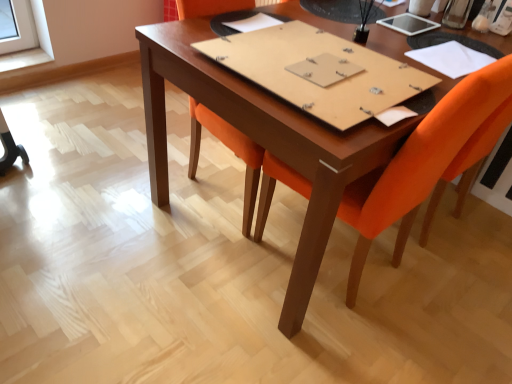
What do you see at coordinates (253, 23) in the screenshot?
I see `white paper at center, which is the 1th notebook from left to right` at bounding box center [253, 23].

The width and height of the screenshot is (512, 384). I want to click on white paper at center, the third notebook viewed from the right, so click(253, 23).

Does point (414, 149) lie in front of point (433, 67)?

Yes, it is in front of point (433, 67).

Based on the photo, how many degrees apart are the facing directions of orange fabric chair at center and white paper at upper right, the third notebook when ordered from left to right?

orange fabric chair at center and white paper at upper right, the third notebook when ordered from left to right, are facing 8.11 degrees away from each other.

Is orange fabric chair at center inside or outside of white paper at upper right, the third notebook when ordered from left to right?

orange fabric chair at center lies outside white paper at upper right, the third notebook when ordered from left to right.

Which is more to the left, orange fabric chair at center or white paper at upper right, the first notebook in the right-to-left sequence?

Positioned to the left is orange fabric chair at center.

Does white paper at upper right, the third notebook when ordered from left to right, turn towards brown cardboard notebook at center, acting as the second notebook starting from the left?

No.

Is white paper at upper right, the third notebook when ordered from left to right, next to brown cardboard notebook at center, acting as the second notebook starting from the left?

No, white paper at upper right, the third notebook when ordered from left to right, is not touching brown cardboard notebook at center, acting as the second notebook starting from the left.

Considering the sizes of objects white paper at upper right, the third notebook when ordered from left to right, and brown cardboard notebook at center, acting as the second notebook starting from the left, in the image provided, who is shorter, white paper at upper right, the third notebook when ordered from left to right, or brown cardboard notebook at center, acting as the second notebook starting from the left,?

white paper at upper right, the third notebook when ordered from left to right, is shorter.

How different are the orientations of white paper at upper right, the third notebook when ordered from left to right, and brown cardboard notebook at center, which is the 2th notebook in right-to-left order, in degrees?

The angular difference between white paper at upper right, the third notebook when ordered from left to right, and brown cardboard notebook at center, which is the 2th notebook in right-to-left order, is 10 degrees.

From a real-world perspective, does brown cardboard notebook at center, which is the 2th notebook in right-to-left order, sit lower than white paper at upper right, the third notebook when ordered from left to right?

No, from a real-world perspective, brown cardboard notebook at center, which is the 2th notebook in right-to-left order, is not beneath white paper at upper right, the third notebook when ordered from left to right.

Does point (266, 49) come farther from viewer compared to point (425, 58)?

No, (266, 49) is closer to viewer.

Based on their positions, is brown cardboard notebook at center, acting as the second notebook starting from the left, located to the left or right of white paper at upper right, the first notebook in the right-to-left sequence?

From the image, it's evident that brown cardboard notebook at center, acting as the second notebook starting from the left, is to the left of white paper at upper right, the first notebook in the right-to-left sequence.

Can white paper at center, the third notebook viewed from the right, be found inside white paper at upper right, the first notebook in the right-to-left sequence?

No, white paper at center, the third notebook viewed from the right, is not inside white paper at upper right, the first notebook in the right-to-left sequence.

Is white paper at upper right, the first notebook in the right-to-left sequence, looking in the opposite direction of white paper at center, the third notebook viewed from the right?

No, white paper at upper right, the first notebook in the right-to-left sequence, is not facing away from white paper at center, the third notebook viewed from the right.

Is the surface of white paper at upper right, the first notebook in the right-to-left sequence, in direct contact with white paper at center, which is the 1th notebook from left to right?

No, white paper at upper right, the first notebook in the right-to-left sequence, is not making contact with white paper at center, which is the 1th notebook from left to right.

Is white paper at upper right, the third notebook when ordered from left to right, to the left or to the right of white paper at center, the third notebook viewed from the right, in the image?

Based on their positions, white paper at upper right, the third notebook when ordered from left to right, is located to the right of white paper at center, the third notebook viewed from the right.

From the image's perspective, is white paper at center, which is the 1th notebook from left to right, located above brown cardboard notebook at center, which is the 2th notebook in right-to-left order?

Indeed, from the image's perspective, white paper at center, which is the 1th notebook from left to right, is shown above brown cardboard notebook at center, which is the 2th notebook in right-to-left order.

Does white paper at center, which is the 1th notebook from left to right, have a greater width compared to brown cardboard notebook at center, acting as the second notebook starting from the left?

No, white paper at center, which is the 1th notebook from left to right, is not wider than brown cardboard notebook at center, acting as the second notebook starting from the left.

Who is smaller, white paper at center, the third notebook viewed from the right, or brown cardboard notebook at center, which is the 2th notebook in right-to-left order?

Smaller between the two is white paper at center, the third notebook viewed from the right.

Considering the sizes of brown cardboard notebook at center, which is the 2th notebook in right-to-left order, and white paper at center, the third notebook viewed from the right, in the image, is brown cardboard notebook at center, which is the 2th notebook in right-to-left order, bigger or smaller than white paper at center, the third notebook viewed from the right,?

Clearly, brown cardboard notebook at center, which is the 2th notebook in right-to-left order, is larger in size than white paper at center, the third notebook viewed from the right.

Is brown cardboard notebook at center, which is the 2th notebook in right-to-left order, oriented away from white paper at center, which is the 1th notebook from left to right?

No, brown cardboard notebook at center, which is the 2th notebook in right-to-left order,'s orientation is not away from white paper at center, which is the 1th notebook from left to right.

Can you confirm if brown cardboard notebook at center, which is the 2th notebook in right-to-left order, is shorter than white paper at center, which is the 1th notebook from left to right?

In fact, brown cardboard notebook at center, which is the 2th notebook in right-to-left order, may be taller than white paper at center, which is the 1th notebook from left to right.

How far apart are brown cardboard notebook at center, acting as the second notebook starting from the left, and white paper at center, the third notebook viewed from the right?

brown cardboard notebook at center, acting as the second notebook starting from the left, and white paper at center, the third notebook viewed from the right, are 36.80 centimeters apart.

The height and width of the screenshot is (384, 512). Find the location of `notebook that is the 1st one when counting forward from the white paper at center, the third notebook viewed from the right`. notebook that is the 1st one when counting forward from the white paper at center, the third notebook viewed from the right is located at coordinates (451, 59).

Consider the image. From the image's perspective, is white paper at center, the third notebook viewed from the right, beneath white paper at upper right, the third notebook when ordered from left to right?

Incorrect, from the image's perspective, white paper at center, the third notebook viewed from the right, is higher than white paper at upper right, the third notebook when ordered from left to right.

Find the location of a particular element. the 1st notebook positioned above the orange fabric chair at center (from a real-world perspective) is located at coordinates (451, 59).

From a real-world perspective, which notebook is the 2nd one underneath the brown cardboard notebook at center, acting as the second notebook starting from the left? Please provide its 2D coordinates.

[(451, 59)]

In the scene shown: Based on their spatial positions, is orange fabric chair at center or brown cardboard notebook at center, which is the 2th notebook in right-to-left order, further from white paper at upper right, the third notebook when ordered from left to right?

Based on the image, orange fabric chair at center appears to be further to white paper at upper right, the third notebook when ordered from left to right.

Considering their positions, is brown cardboard notebook at center, which is the 2th notebook in right-to-left order, positioned closer to orange fabric chair at center than white paper at upper right, the third notebook when ordered from left to right?

Among the two, brown cardboard notebook at center, which is the 2th notebook in right-to-left order, is located nearer to orange fabric chair at center.

Considering their positions, is white paper at center, which is the 1th notebook from left to right, positioned further to brown cardboard notebook at center, acting as the second notebook starting from the left, than orange fabric chair at center?

white paper at center, which is the 1th notebook from left to right.

Which object lies further to the anchor point brown cardboard notebook at center, which is the 2th notebook in right-to-left order, orange fabric chair at center or white paper at center, which is the 1th notebook from left to right?

white paper at center, which is the 1th notebook from left to right.

Which object lies further to the anchor point orange fabric chair at center, white paper at upper right, the third notebook when ordered from left to right, or brown cardboard notebook at center, which is the 2th notebook in right-to-left order?

white paper at upper right, the third notebook when ordered from left to right.

When comparing their distances from white paper at center, the third notebook viewed from the right, does white paper at upper right, the first notebook in the right-to-left sequence, or orange fabric chair at center seem further?

The object further to white paper at center, the third notebook viewed from the right, is orange fabric chair at center.

Estimate the real-world distances between objects in this image. Which object is closer to brown cardboard notebook at center, which is the 2th notebook in right-to-left order, white paper at upper right, the first notebook in the right-to-left sequence, or orange fabric chair at center?

orange fabric chair at center lies closer to brown cardboard notebook at center, which is the 2th notebook in right-to-left order, than the other object.

From the image, which object appears to be farther from white paper at upper right, the first notebook in the right-to-left sequence, orange fabric chair at center or white paper at center, the third notebook viewed from the right?

Among the two, white paper at center, the third notebook viewed from the right, is located further to white paper at upper right, the first notebook in the right-to-left sequence.

Identify the location of notebook between orange fabric chair at center and white paper at upper right, the third notebook when ordered from left to right, from front to back. The height and width of the screenshot is (384, 512). (319, 71).

Identify the location of chair located between white paper at center, the third notebook viewed from the right, and white paper at upper right, the first notebook in the right-to-left sequence, in the left-right direction. (420, 164).

The image size is (512, 384). I want to click on notebook located between white paper at center, which is the 1th notebook from left to right, and white paper at upper right, the third notebook when ordered from left to right, in the left-right direction, so [x=319, y=71].